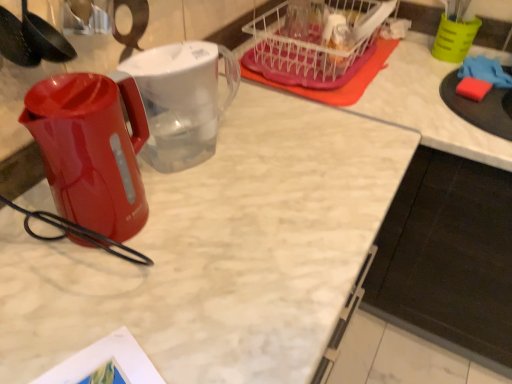
The image size is (512, 384). I want to click on vacant space that is in between green plastic cup at upper right and translucent plastic basket at upper right, so click(x=404, y=63).